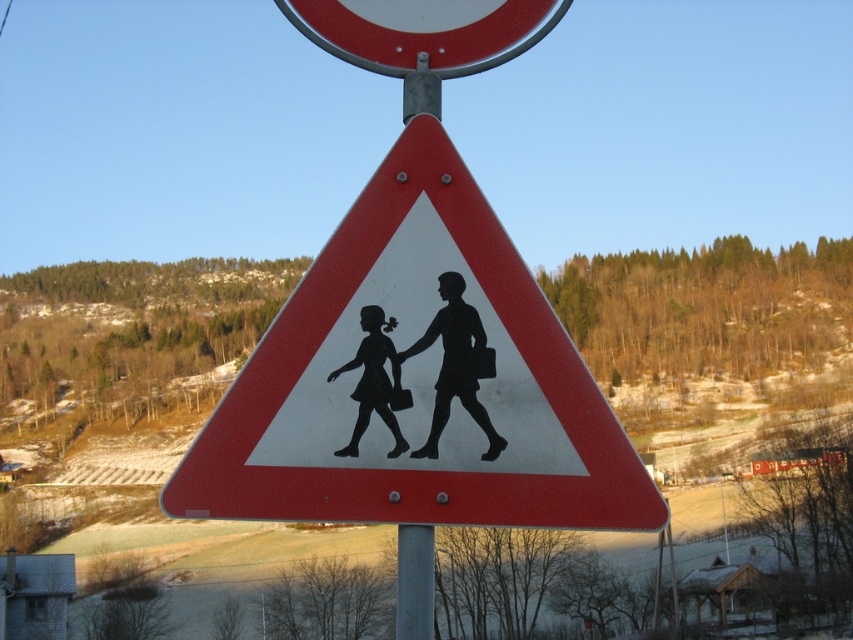
You are a delivery driver who needs to attach a rectangular sticker measuring 12 inches in height to the pole between the white paper triangle at center and the smooth metal circle at upper center. Can you fit the sticker vertically between them without overlapping either sign?

The distance between the white paper triangle at center and the smooth metal circle at upper center is 36.23 inches. Since the sticker is only 12 inches tall, there is enough space to fit it vertically between them without overlapping either sign.

You are a pedestrian trying to read two signs on a pole. The white paper triangle at center and the smooth metal circle at upper center. Which sign is located to the right of the other?

The white paper triangle at center is positioned on the right side of smooth metal circle at upper center.

You are a driver approaching an intersection and see the white paper triangle at center and the smooth metal circle at upper center. Which object is located lower in the scene?

The white paper triangle at center is positioned under the smooth metal circle at upper center, so the white paper triangle at center is lower than the smooth metal circle at upper center.